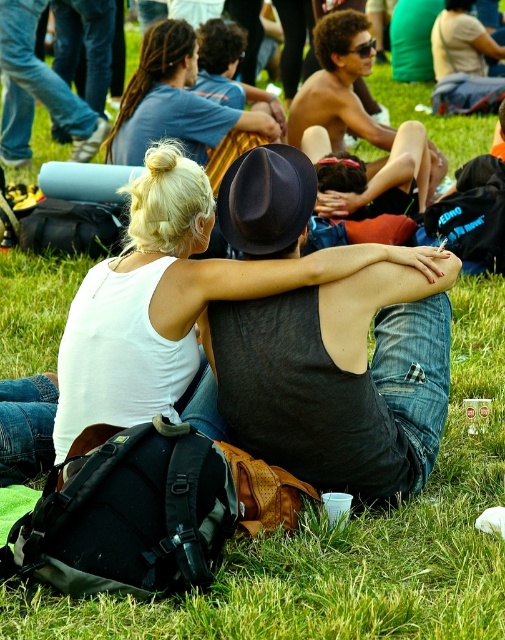
From the picture: You are a photographer trying to capture a candid shot of the two central figures in the scene. You notice the white matte tank top at center and the shiny black hat at center. Which clothing item is shorter in height when viewed from above?

The white matte tank top at center is shorter than the shiny black hat at center, so the white matte tank top at center would appear shorter in height when viewed from above.